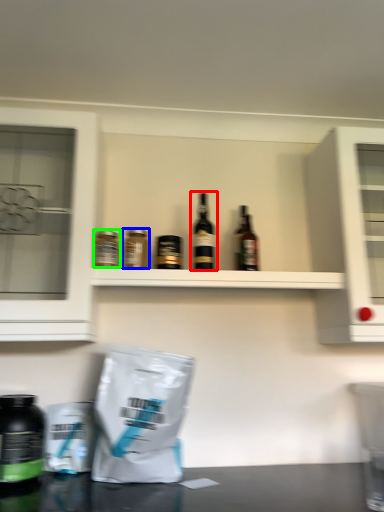
Question: Which object is positioned closest to bottle (highlighted by a red box)? Select from bottle (highlighted by a blue box) and bottle (highlighted by a green box).

Choices:
 (A) bottle
 (B) bottle

Answer: (A)